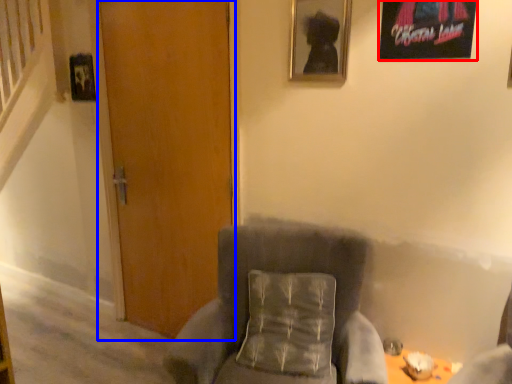
Question: Which point is further to the camera, picture frame (highlighted by a red box) or door (highlighted by a blue box)?

Choices:
 (A) picture frame
 (B) door

Answer: (B)